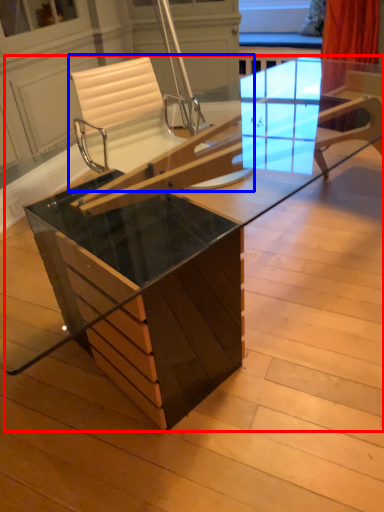
Question: Which point is further to the camera, table (highlighted by a red box) or chair (highlighted by a blue box)?

Choices:
 (A) table
 (B) chair

Answer: (B)